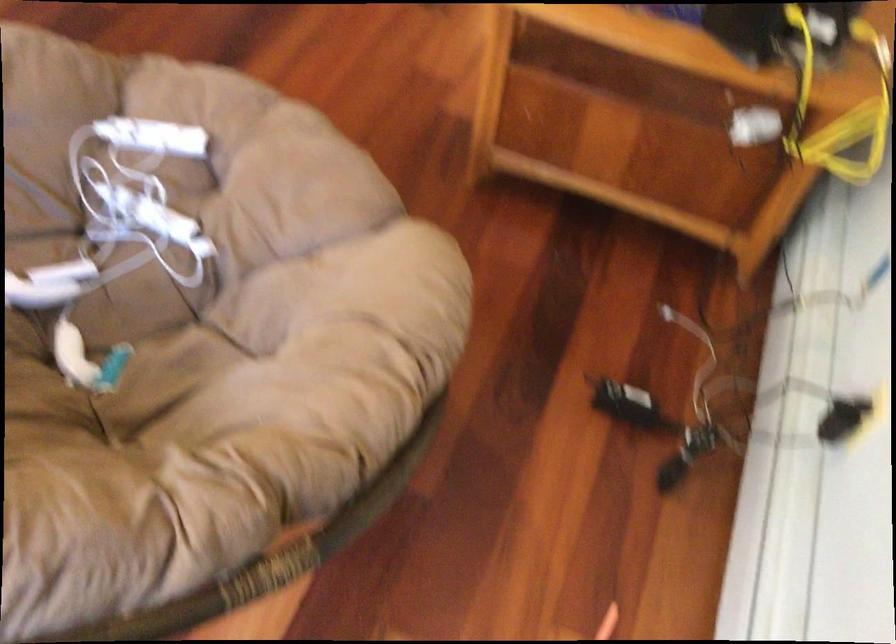
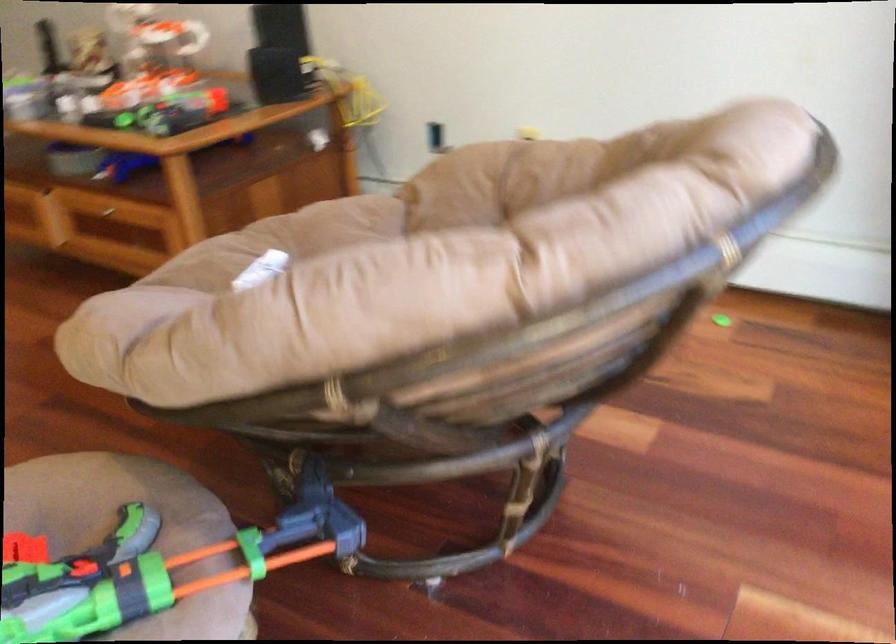
Question: I am providing you with two images of the same scene from different viewpoints. After the viewpoint changes to image2, which objects are now occluded?

Choices:
 (A) white game controller
 (B) green foam disc
 (C) drawer handle
 (D) orange container lid

Answer: (A)